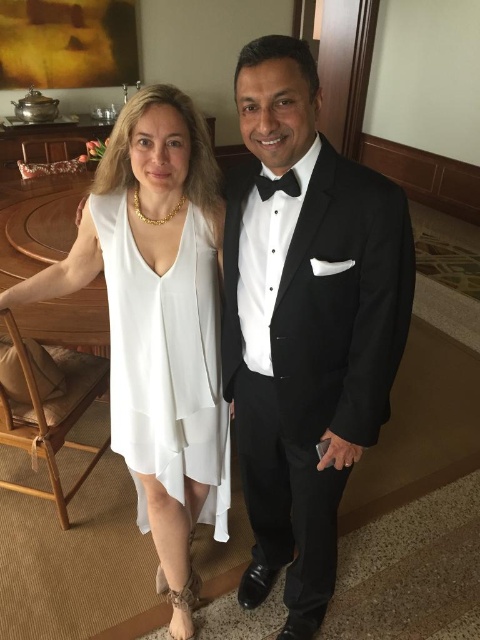
Does white silk dress at center lie in front of black satin bow tie at center?

No, white silk dress at center is behind black satin bow tie at center.

Is white silk dress at center taller than black satin bow tie at center?

Correct, white silk dress at center is much taller as black satin bow tie at center.

Who is more forward, (148, 448) or (276, 189)?

Positioned in front is point (276, 189).

Where is `white silk dress at center`? white silk dress at center is located at coordinates (158, 323).

Is white silk dress at center closer to camera compared to white sheer dress at center?

Yes, it is.

Is point (131, 336) farther from viewer compared to point (110, 428)?

No, (131, 336) is closer to viewer.

Who is more distant from viewer, [145,170] or [182,396]?

Positioned behind is point [182,396].

The width and height of the screenshot is (480, 640). In order to click on white silk dress at center in this screenshot , I will do `click(158, 323)`.

Does black satin tuxedo at center have a greater height compared to white sheer dress at center?

Yes.

Between black satin tuxedo at center and white sheer dress at center, which one appears on the right side from the viewer's perspective?

From the viewer's perspective, black satin tuxedo at center appears more on the right side.

Looking at this image, who is more distant from viewer, (286, 321) or (224, 518)?

The point (224, 518) is more distant.

I want to click on black satin tuxedo at center, so click(x=305, y=324).